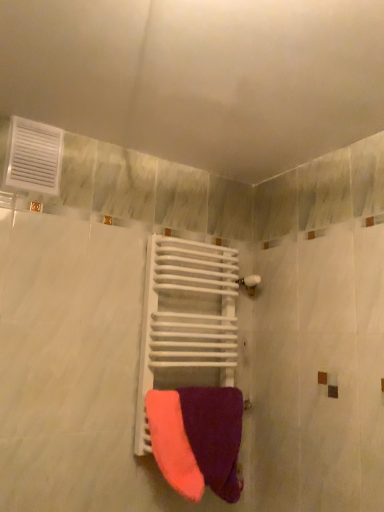
Question: In terms of width, does white matte towel rack at center look wider or thinner when compared to purple soft towel at center?

Choices:
 (A) thin
 (B) wide

Answer: (B)

Question: Is white matte towel rack at center taller or shorter than purple soft towel at center?

Choices:
 (A) tall
 (B) short

Answer: (A)

Question: Estimate the real-world distances between objects in this image. Which object is farther from the purple soft towel at center?

Choices:
 (A) white plastic vent at upper left
 (B) white matte towel rack at center

Answer: (A)

Question: Considering the real-world distances, which object is farthest from the white plastic vent at upper left?

Choices:
 (A) purple soft towel at center
 (B) white matte towel rack at center

Answer: (A)